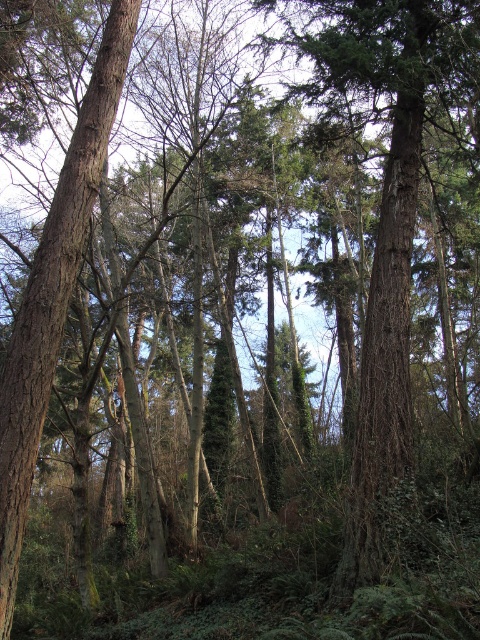
From the picture: You are standing at the point marked by point (398, 316) in the forest. You need to walk to a tree that is exactly 8.71 meters away from your current position. Can you reach it without leaving the forest area shown in the image?

Yes, you can reach the tree that is exactly 8.71 meters away from point (398, 316) because the forest area shown in the image extends far enough to accommodate that distance.

Based on the photo, you are an explorer navigating through the forest and need to locate the green rough bark tree at center. Based on the scene description, which direction should you move relative to the brown rough bark tree at left to find it?

The green rough bark tree at center is to the right of the brown rough bark tree at left, so you should move to the right of the brown rough bark tree at left to locate it.

You are standing in the forest and want to locate the green rough bark tree at center. According to the coordinates given, where would you look relative to your position?

The green rough bark tree at center is located at coordinates 0.359 on the x axis and 0.806 on the y axis, so you should look towards the lower middle area of the forest scene.